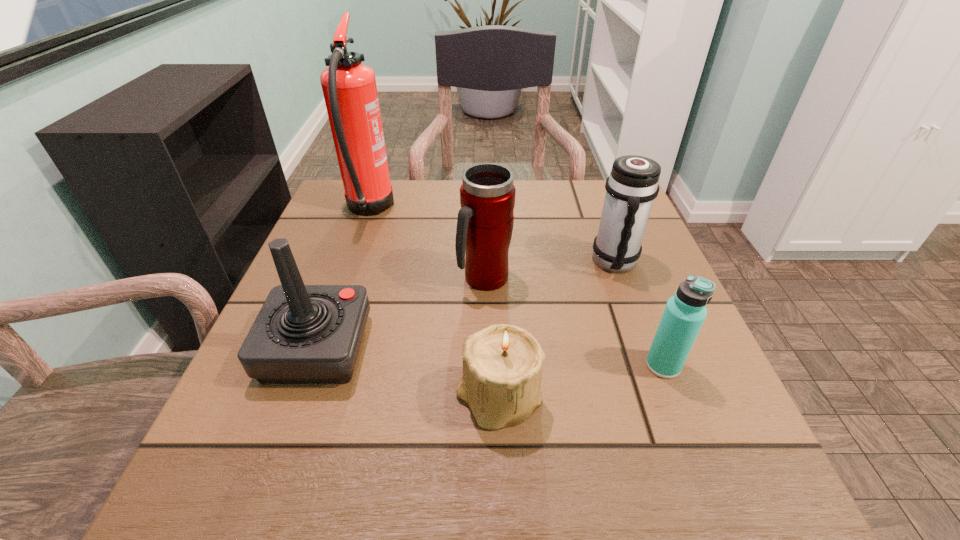
The height and width of the screenshot is (540, 960). In order to click on the farthest object in this screenshot , I will do `click(349, 88)`.

You are a GUI agent. You are given a task and a screenshot of the screen. Output one action in this format:
    pyautogui.click(x=<x>, y=<y>)
    Task: Click on the fire extinguisher
    
    Given the screenshot: What is the action you would take?
    pyautogui.click(x=349, y=88)

Locate an element on the screen. This screenshot has width=960, height=540. the leftmost thermos bottle is located at coordinates (485, 221).

At what (x,y) coordinates should I click in order to perform the action: click on joystick. Please return your answer as a coordinate pair (x, y). The image size is (960, 540). Looking at the image, I should click on (304, 334).

Find the location of `the shortest thermos bottle`. the shortest thermos bottle is located at coordinates (685, 312).

I want to click on the shortest object, so click(502, 364).

Locate an element on the screen. The image size is (960, 540). vacant space located 0.310m at the nozzle of the fire extinguisher is located at coordinates (517, 210).

The height and width of the screenshot is (540, 960). In order to click on vacant space located 0.150m on the side with the handle of the leftmost thermos bottle in this screenshot , I will do `click(486, 359)`.

Where is `free space located 0.380m on the front-facing side of the joystick`? The height and width of the screenshot is (540, 960). free space located 0.380m on the front-facing side of the joystick is located at coordinates (586, 348).

Where is `vacant space located 0.090m on the left of the shortest thermos bottle`? vacant space located 0.090m on the left of the shortest thermos bottle is located at coordinates (592, 365).